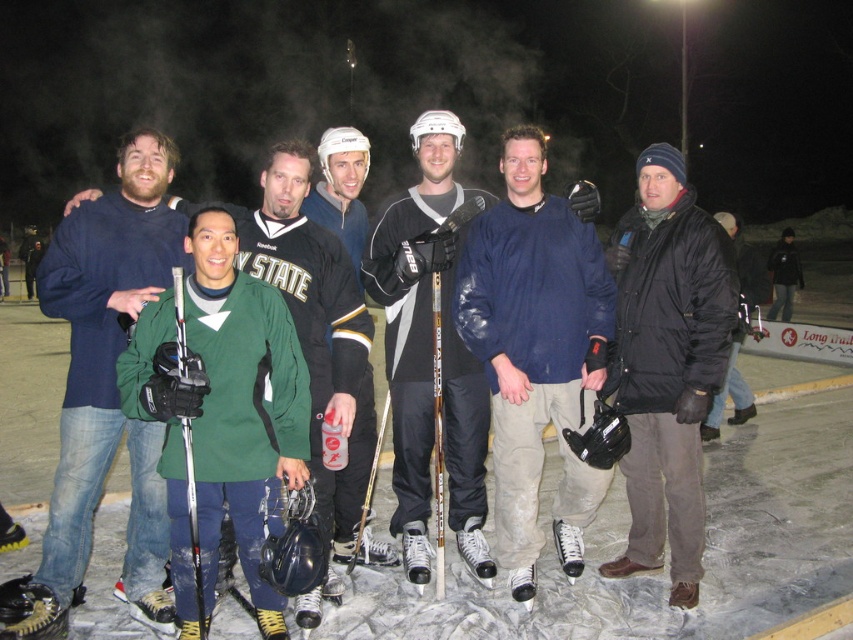
Question: Is matte blue hockey jersey at center to the left of black puffy jacket at center from the viewer's perspective?

Choices:
 (A) no
 (B) yes

Answer: (B)

Question: Which point appears farthest from the camera in this image?

Choices:
 (A) click(590, 257)
 (B) click(268, 156)
 (C) click(679, 364)
 (D) click(724, 388)

Answer: (D)

Question: Does green matte hockey stick at left appear on the left side of green matte hockey jersey at center?

Choices:
 (A) yes
 (B) no

Answer: (A)

Question: Is black puffy jacket at center below black matte jacket at center?

Choices:
 (A) yes
 (B) no

Answer: (A)

Question: Considering the real-world distances, which object is closest to the green matte hockey jersey at center?

Choices:
 (A) green matte hockey stick at left
 (B) matte blue hockey jersey at center
 (C) black matte jacket at center
 (D) black puffy jacket at center

Answer: (A)

Question: Which of the following is the closest to the observer?

Choices:
 (A) click(x=281, y=141)
 (B) click(x=738, y=400)

Answer: (A)